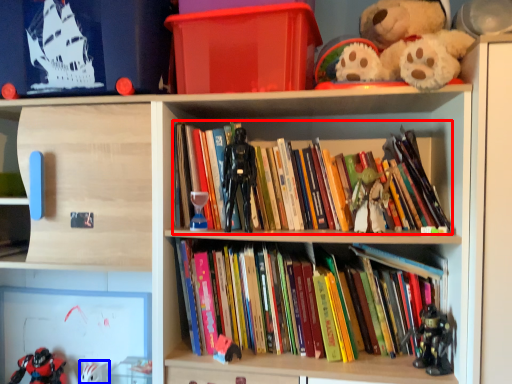
Question: Which object appears farthest to the camera in this image, book (highlighted by a red box) or toy (highlighted by a blue box)?

Choices:
 (A) book
 (B) toy

Answer: (B)